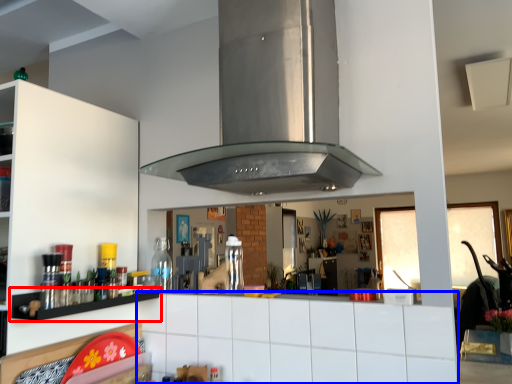
Question: Which point is closer to the camera, shelf (highlighted by a red box) or counter top (highlighted by a blue box)?

Choices:
 (A) shelf
 (B) counter top

Answer: (B)